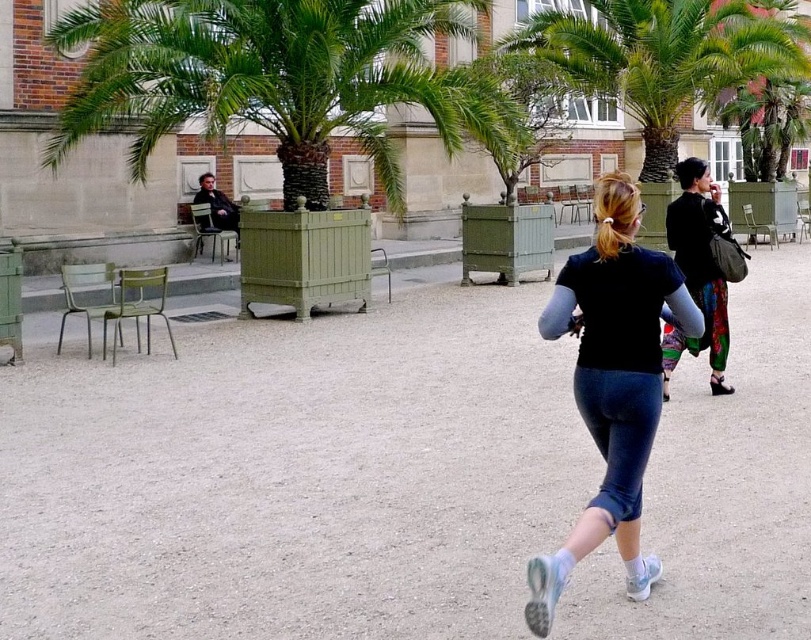
Question: Considering the relative positions of blonde hair at center and matte black jacket at left in the image provided, where is blonde hair at center located with respect to matte black jacket at left?

Choices:
 (A) below
 (B) above

Answer: (A)

Question: Estimate the real-world distances between objects in this image. Which object is closer to the gray gravel at center?

Choices:
 (A) green wooden planter at left
 (B) matte black jacket at left

Answer: (A)

Question: Among these points, which one is farthest from the camera?

Choices:
 (A) (x=689, y=189)
 (B) (x=670, y=278)
 (C) (x=316, y=132)
 (D) (x=20, y=580)

Answer: (C)

Question: Is dark blue jersey at center to the right of blonde hair at center from the viewer's perspective?

Choices:
 (A) yes
 (B) no

Answer: (B)

Question: Which of the following is the farthest from the observer?

Choices:
 (A) dark blue jersey at center
 (B) matte black jacket at left
 (C) gray gravel at center

Answer: (B)

Question: Is dark blue jersey at center wider than blonde hair at center?

Choices:
 (A) no
 (B) yes

Answer: (A)